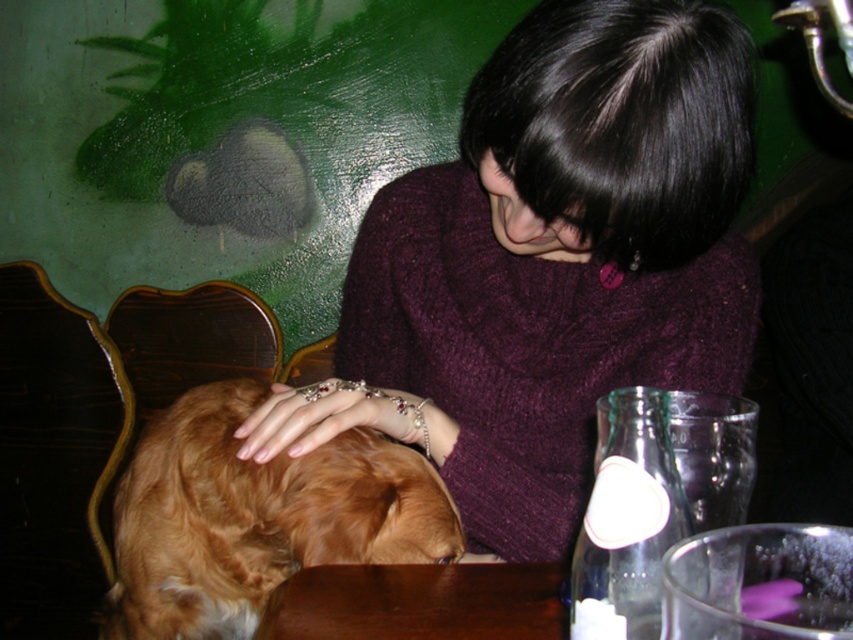
You are a person standing in front of the table where the woman and dog are. You want to reach the purple knitted sweater at center to pick it up. Can you estimate whether you can comfortably reach it without moving your feet?

The purple knitted sweater at center is 24.93 inches away from the viewer. Since the average comfortable reaching distance for most adults is around 24 inches, it might be slightly out of reach. You may need to take a small step forward to grab it comfortably.

You are standing in the room and see the point at coordinates (548, 262). What object is located at that point?

The point at coordinates (548, 262) marks the purple knitted sweater at center.

You are organizing a photoshoot and need to ensure that the purple knitted sweater at center and the brown fluffy dog at lower left are both visible in the frame. Given their sizes, which object should you prioritize positioning closer to the camera to maintain their visibility?

The brown fluffy dog at lower left should be positioned closer to the camera since it is smaller in size compared to the purple knitted sweater at center, ensuring both remain visible in the frame.